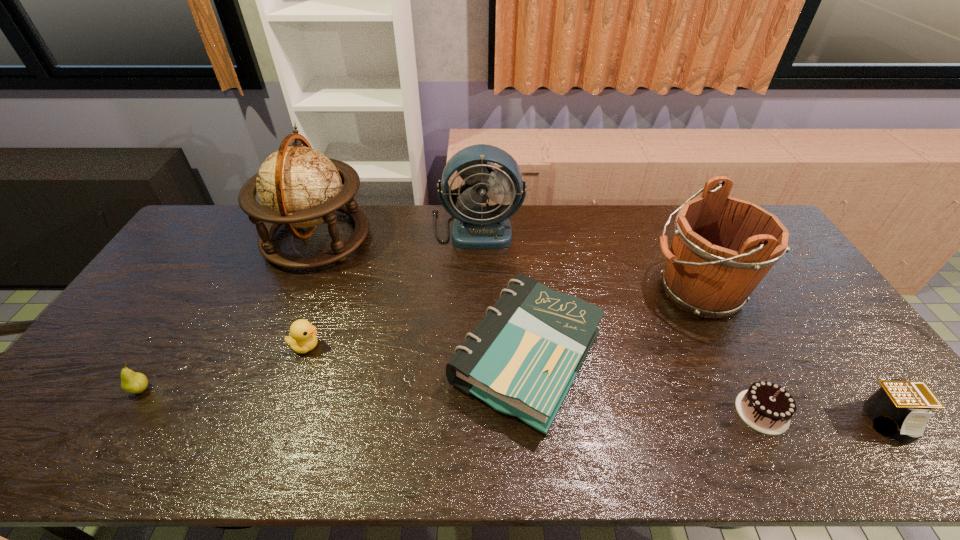
Where is `free space located 0.390m with the handle on the side of the bucket`? The width and height of the screenshot is (960, 540). free space located 0.390m with the handle on the side of the bucket is located at coordinates (521, 291).

Find the location of a particular element. The image size is (960, 540). free space located 0.110m with the handle on the side of the bucket is located at coordinates (611, 291).

Identify the location of free space located 0.100m with the handle on the side of the bucket. (614, 291).

Find the location of a particular element. This screenshot has width=960, height=540. free space located 0.100m on the back of the paperback book is located at coordinates (518, 273).

I want to click on vacant area situated on the right of the leftmost object, so click(x=226, y=389).

Locate an element on the screen. This screenshot has height=540, width=960. vacant space located on the face of the duck is located at coordinates (450, 346).

In order to click on vacant region located 0.250m on the left of the chocolate cake in this screenshot , I will do `click(635, 411)`.

Where is `free region located on the back of the rightmost object`? The width and height of the screenshot is (960, 540). free region located on the back of the rightmost object is located at coordinates (857, 375).

The height and width of the screenshot is (540, 960). I want to click on globe that is at the far edge, so click(298, 186).

Identify the location of fan at the far edge. (475, 227).